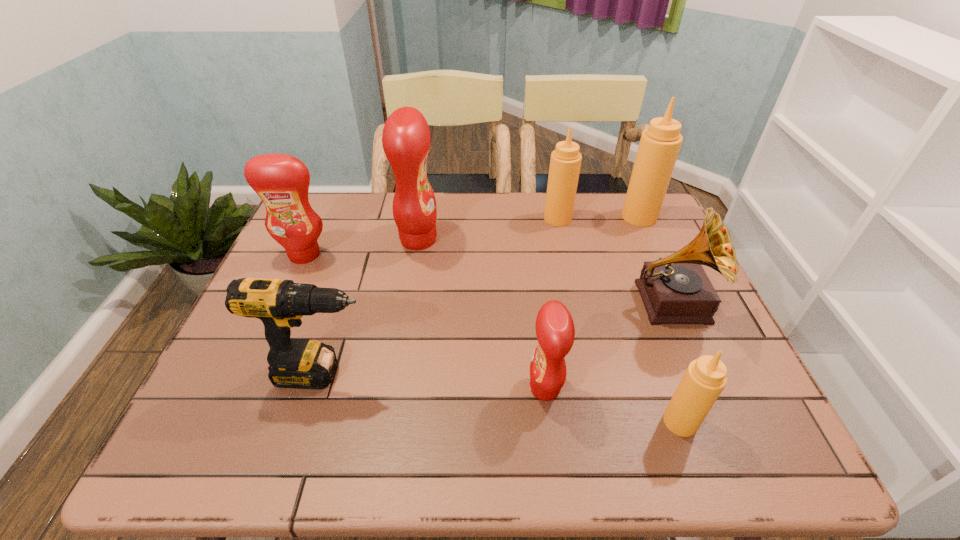
The width and height of the screenshot is (960, 540). I want to click on drill, so click(294, 363).

You are a GUI agent. You are given a task and a screenshot of the screen. Output one action in this format:
    pyautogui.click(x=<x>, y=<y>)
    Task: Click on the nearest red condiment
    The width and height of the screenshot is (960, 540).
    Given the screenshot: What is the action you would take?
    pyautogui.click(x=555, y=331)

Locate an element on the screen. the fourth object from left to right is located at coordinates (555, 331).

Image resolution: width=960 pixels, height=540 pixels. I want to click on the second condiment from right to left, so click(x=705, y=378).

I want to click on the smallest tan condiment, so click(705, 378).

Identify the location of blank space located on the label side of the fifth condiment from right to left. This screenshot has width=960, height=540. (490, 239).

The height and width of the screenshot is (540, 960). I want to click on free space located on the left of the rightmost condiment, so click(533, 217).

Where is `vacant space located on the left of the leftmost tan condiment`? This screenshot has height=540, width=960. vacant space located on the left of the leftmost tan condiment is located at coordinates (483, 219).

The width and height of the screenshot is (960, 540). Identify the location of blank space located 0.130m on the label side of the leftmost red condiment. (284, 300).

In order to click on vacant space located 0.240m from the horn of the phonograph record in this screenshot , I will do click(x=732, y=442).